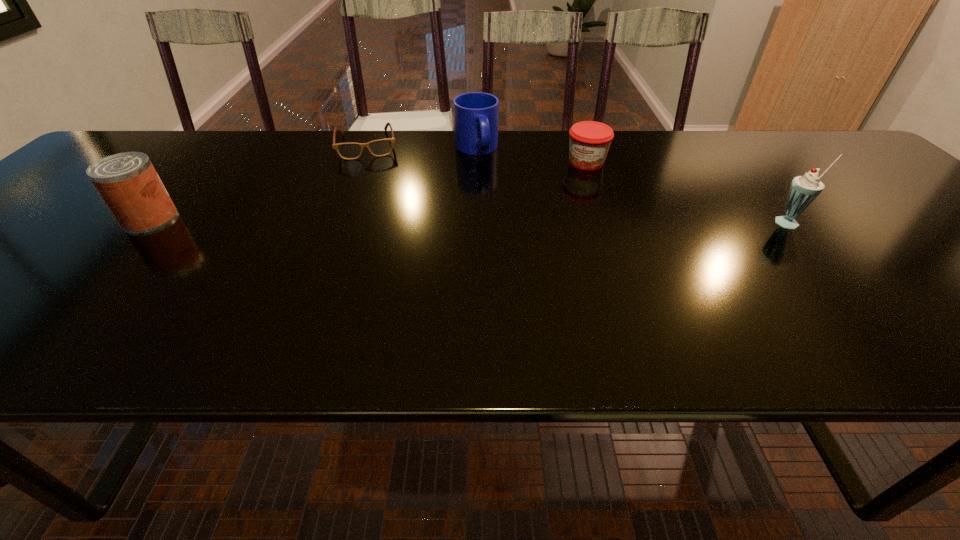
The image size is (960, 540). Identify the location of free spot on the desktop that is between the can and the rightmost object and is positioned on the side with the handle of the mug. (512, 221).

At what (x,y) coordinates should I click in order to perform the action: click on vacant spot on the desktop that is between the leftmost object and the rightmost object and is positioned on the front-facing side of the spectacles. Please return your answer as a coordinate pair (x, y). Looking at the image, I should click on (376, 220).

Where is `free spot on the desktop that is between the can and the milkshake and is positioned on the label side of the jam`? The width and height of the screenshot is (960, 540). free spot on the desktop that is between the can and the milkshake and is positioned on the label side of the jam is located at coordinates (552, 221).